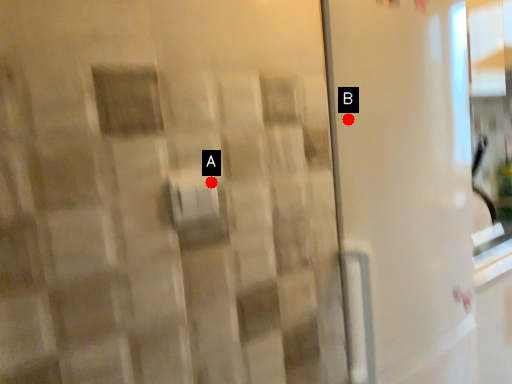
Question: Two points are circled on the image, labeled by A and B beside each circle. Among these points, which one is nearest to the camera?

Choices:
 (A) A is closer
 (B) B is closer

Answer: (A)